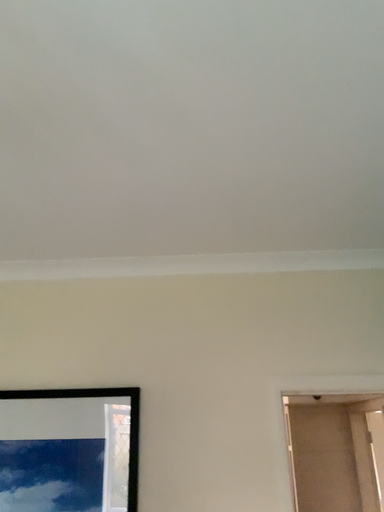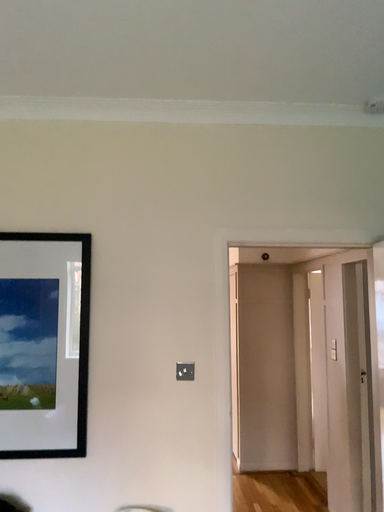
Question: How did the camera likely rotate when shooting the video?

Choices:
 (A) rotated upward
 (B) rotated downward

Answer: (B)